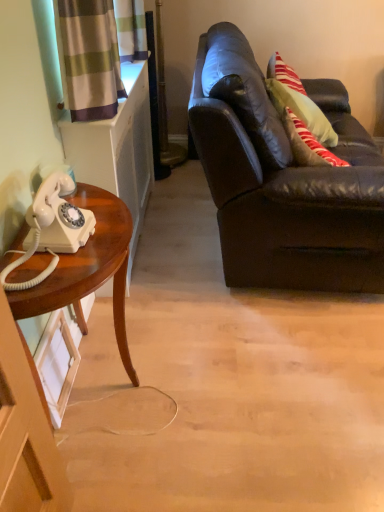
Question: From a real-world perspective, does matte black leather couch at right sit lower than wooden desk at left?

Choices:
 (A) yes
 (B) no

Answer: (B)

Question: Would you consider matte black leather couch at right to be distant from wooden desk at left?

Choices:
 (A) no
 (B) yes

Answer: (A)

Question: From a real-world perspective, is matte black leather couch at right physically above wooden desk at left?

Choices:
 (A) yes
 (B) no

Answer: (A)

Question: Can you confirm if matte black leather couch at right is taller than wooden desk at left?

Choices:
 (A) no
 (B) yes

Answer: (B)

Question: Is matte black leather couch at right smaller than wooden desk at left?

Choices:
 (A) yes
 (B) no

Answer: (B)

Question: From the image's perspective, relative to matte black leather couch at right, is wooden desk at left above or below?

Choices:
 (A) above
 (B) below

Answer: (B)

Question: In the image, is wooden desk at left positioned in front of or behind matte black leather couch at right?

Choices:
 (A) front
 (B) behind

Answer: (A)

Question: Is wooden desk at left bigger or smaller than matte black leather couch at right?

Choices:
 (A) small
 (B) big

Answer: (A)

Question: From a real-world perspective, is wooden desk at left above or below matte black leather couch at right?

Choices:
 (A) above
 (B) below

Answer: (B)

Question: In terms of width, does matte black leather couch at right look wider or thinner when compared to wooden desk at left?

Choices:
 (A) wide
 (B) thin

Answer: (A)

Question: From a real-world perspective, is matte black leather couch at right positioned above or below wooden desk at left?

Choices:
 (A) above
 (B) below

Answer: (A)

Question: In terms of size, does matte black leather couch at right appear bigger or smaller than wooden desk at left?

Choices:
 (A) big
 (B) small

Answer: (A)

Question: Is matte black leather couch at right in front of or behind wooden desk at left in the image?

Choices:
 (A) front
 (B) behind

Answer: (B)

Question: Does point (36, 224) appear closer or farther from the camera than point (104, 212)?

Choices:
 (A) closer
 (B) farther

Answer: (A)

Question: From a real-world perspective, relative to wooden desk at left, is white glossy corded phone at left vertically above or below?

Choices:
 (A) below
 (B) above

Answer: (B)